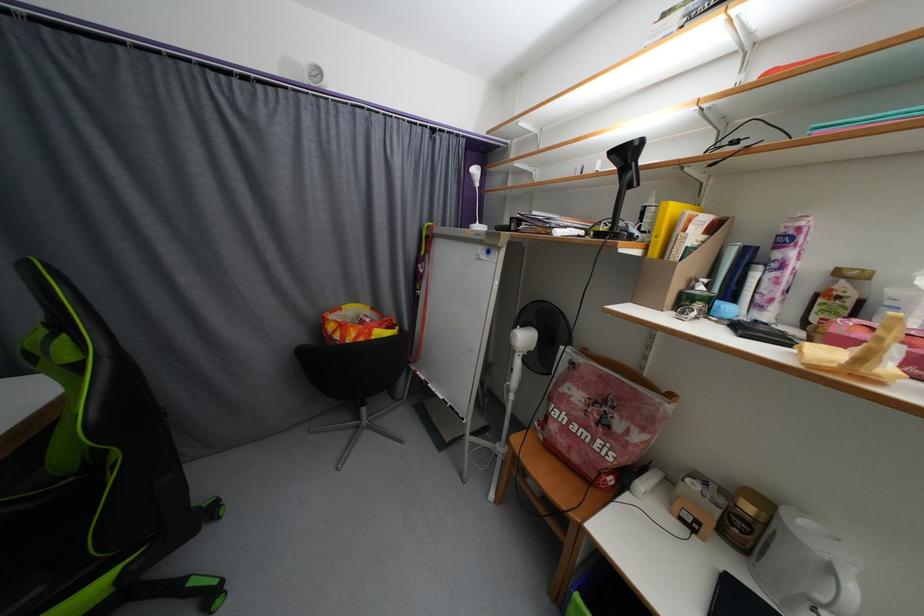
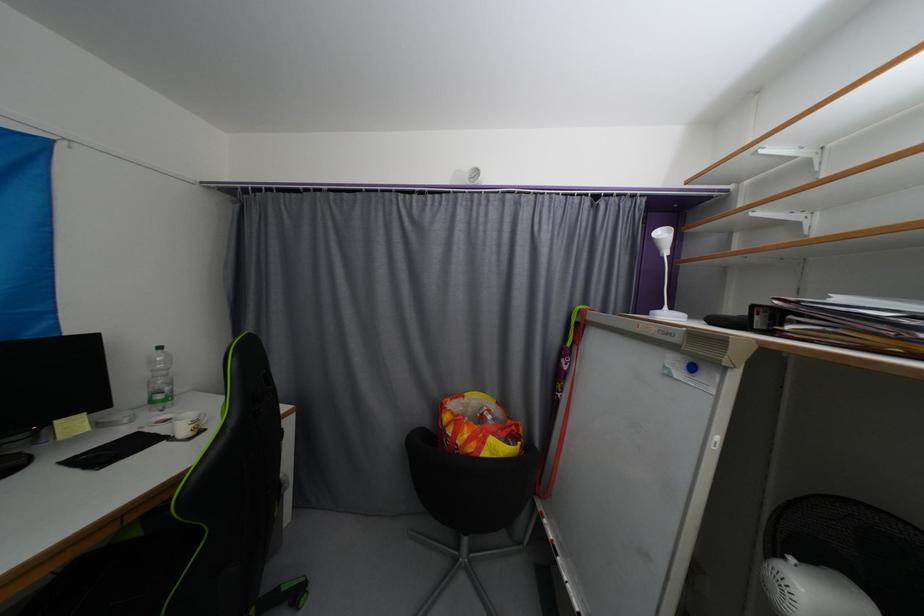
Question: The camera is either moving clockwise (left) or counter-clockwise (right) around the object. The first image is from the beginning of the video and the second image is from the end. Is the camera moving left or right when shooting the video?

Choices:
 (A) Left
 (B) Right

Answer: (B)